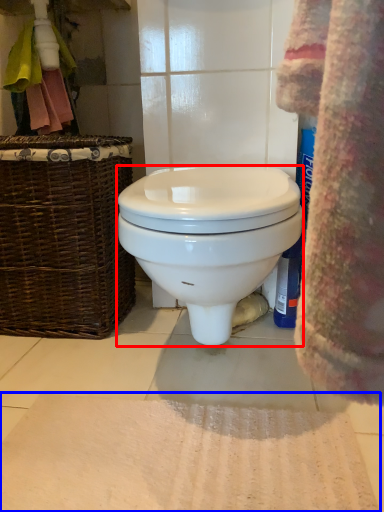
Question: Which point is further to the camera, toilet (highlighted by a red box) or bath mat (highlighted by a blue box)?

Choices:
 (A) toilet
 (B) bath mat

Answer: (A)